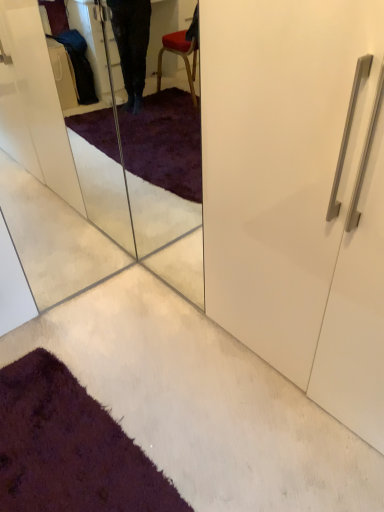
Question: Should I look upward or downward to see transparent glass door at lower left?

Choices:
 (A) down
 (B) up

Answer: (B)